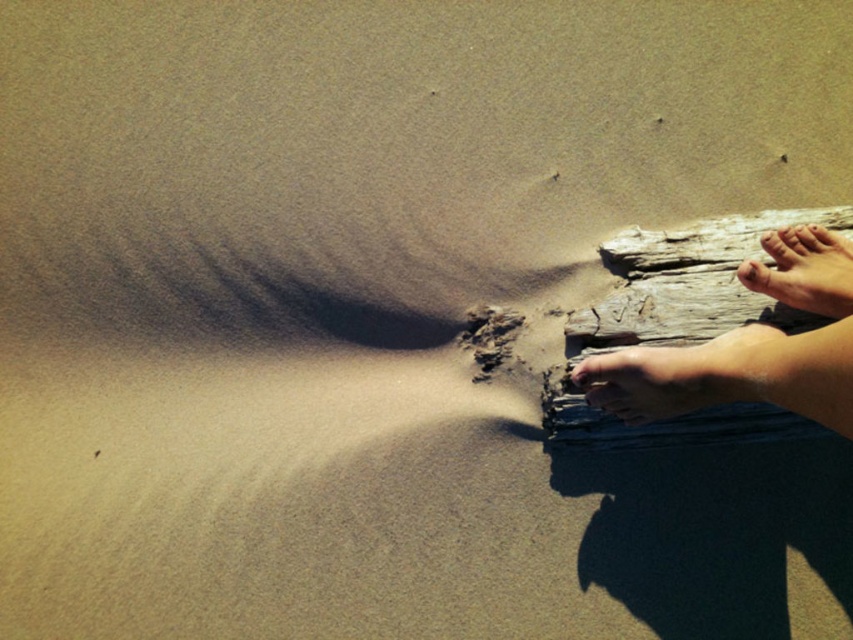
The image size is (853, 640). What do you see at coordinates (680, 324) in the screenshot? I see `gray weathered wood at right` at bounding box center [680, 324].

Between gray weathered wood at right and smooth skin foot at right, which one is positioned lower?

Positioned lower is gray weathered wood at right.

Between point (726, 272) and point (787, 234), which one is positioned in front?

Point (787, 234) is more forward.

What are the coordinates of `gray weathered wood at right` in the screenshot? It's located at (680, 324).

Does smooth skin foot at lower right lie behind smooth skin foot at right?

No, smooth skin foot at lower right is in front of smooth skin foot at right.

The image size is (853, 640). What do you see at coordinates (656, 380) in the screenshot?
I see `smooth skin foot at lower right` at bounding box center [656, 380].

Who is more forward, (x=593, y=372) or (x=824, y=312)?

Point (x=824, y=312)

Locate an element on the screen. smooth skin foot at lower right is located at coordinates (656, 380).

How much distance is there between gray weathered wood at right and smooth skin foot at lower right?

gray weathered wood at right is 5.79 inches away from smooth skin foot at lower right.

Is gray weathered wood at right in front of smooth skin foot at lower right?

No, gray weathered wood at right is behind smooth skin foot at lower right.

I want to click on gray weathered wood at right, so click(x=680, y=324).